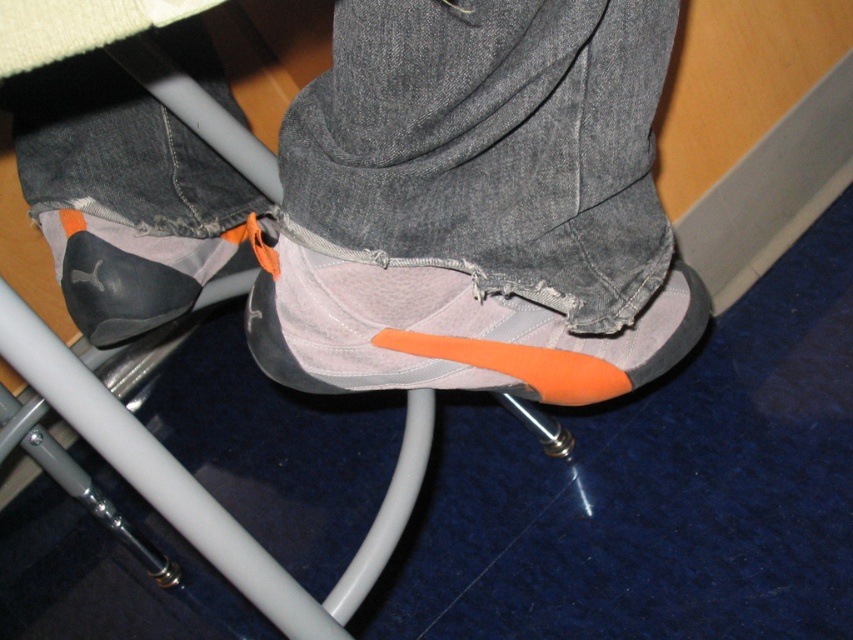
Question: Does matte gray shoe at center come in front of gray fabric shoe at center?

Choices:
 (A) yes
 (B) no

Answer: (A)

Question: Which point is farther to the camera?

Choices:
 (A) (288, 385)
 (B) (166, 307)
 (C) (416, 237)

Answer: (B)

Question: Which object is positioned farthest from the matte gray shoe at center?

Choices:
 (A) matte black sneaker at lower center
 (B) gray fabric shoe at center

Answer: (A)

Question: Does matte gray shoe at center appear on the right side of gray fabric shoe at center?

Choices:
 (A) no
 (B) yes

Answer: (A)

Question: Which point is farther from the camera taking this photo?

Choices:
 (A) (660, 291)
 (B) (96, 209)

Answer: (B)

Question: Does matte gray shoe at center appear on the right side of matte black sneaker at lower center?

Choices:
 (A) no
 (B) yes

Answer: (B)